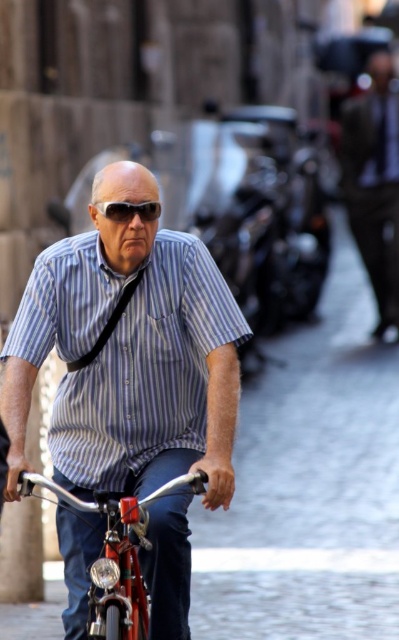
You are a delivery person who needs to carry a package that is as wide as the shiny metallic bicycle at center. Can you place the package on the matte black sunglasses at center without it falling off?

The shiny metallic bicycle at center might be wider than matte black sunglasses at center, so placing a package as wide as the bicycle on the sunglasses would likely cause it to fall off since the sunglasses are narrower.

You are a pedestrian trying to cross the street safely. You see the dark brown leather jacket at upper right and the matte black sunglasses at center. Which object is closer to the ground?

The dark brown leather jacket at upper right is positioned under matte black sunglasses at center, so the dark brown leather jacket at upper right is closer to the ground.

You are standing at the point with coordinates point (126, 211) and want to move to the point with coordinates point (112, 621). Which direction should you move to get closer to the destination?

You should move towards the direction of point (112, 621) because it is closer to the viewer than point (126, 211).